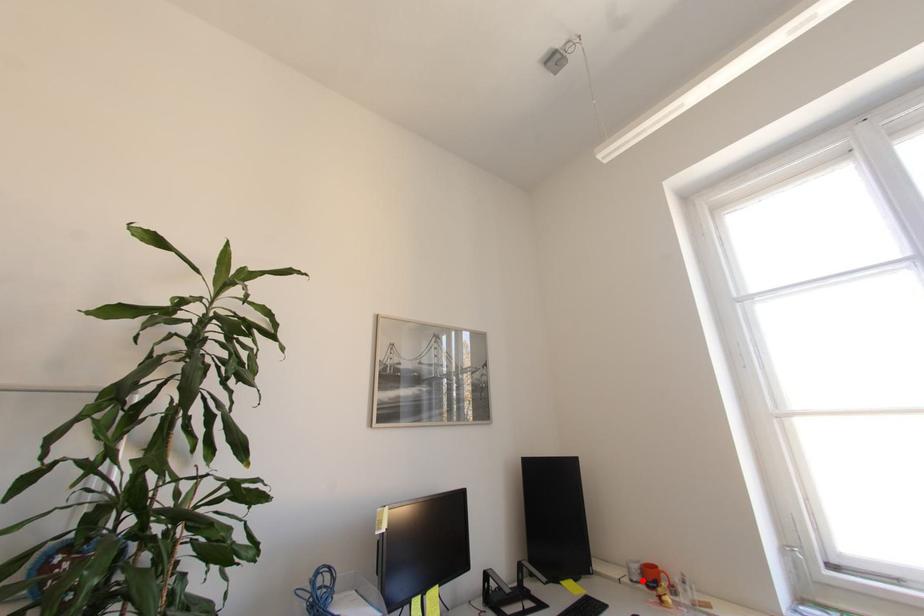
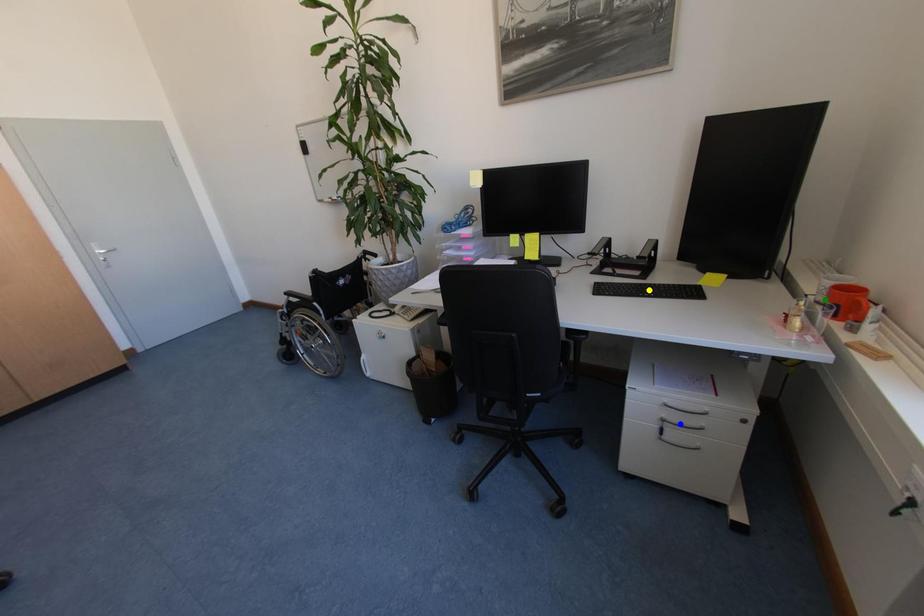
Question: I am providing you with two images of the same scene from different viewpoints. A red point is marked on the first image. You are given multiple points on the second image. In image 2, which mark is for the same physical point as the one in image 1?

Choices:
 (A) yellow point
 (B) green point
 (C) blue point

Answer: (B)